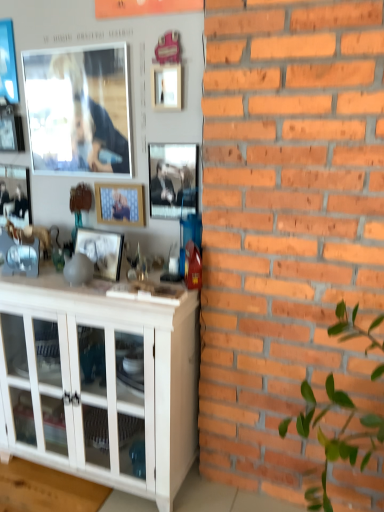
Question: Is point (21, 132) positioned closer to the camera than point (3, 44)?

Choices:
 (A) farther
 (B) closer

Answer: (A)

Question: From a real-world perspective, is metallic silver picture frame at upper left, the sixth picture frame in the right-to-left sequence, positioned above or below metallic blue picture frame at upper left, the first picture frame positioned from the left?

Choices:
 (A) above
 (B) below

Answer: (B)

Question: Estimate the real-world distances between objects in this image. Which object is farther from the matte glass picture frame at upper left, which appears as the 5th picture frame when viewed from the right?

Choices:
 (A) matte wooden picture frame at center, the fourth picture frame positioned from the right
 (B) metallic blue picture frame at upper left, the first picture frame positioned from the left
 (C) pink matte picture frame at upper center, arranged as the 7th picture frame when viewed from the left
 (D) matte black picture frame at left, which is the second picture frame in left-to-right order
 (E) metallic silver picture frame at center, which is counted as the eighth picture frame, starting from the left

Answer: (A)

Question: Considering the real-world distances, which object is closest to the wooden frame at center, the 3th picture frame in the right-to-left sequence?

Choices:
 (A) matte wooden picture frame at center, the fourth picture frame positioned from the right
 (B) matte black picture frame at left, which is counted as the 7th picture frame, starting from the right
 (C) metallic silver picture frame at center, positioned as the first picture frame in right-to-left order
 (D) matte glass picture frame at upper left, which is counted as the 4th picture frame, starting from the left
 (E) pink matte picture frame at upper center, placed as the second picture frame when sorted from right to left

Answer: (C)